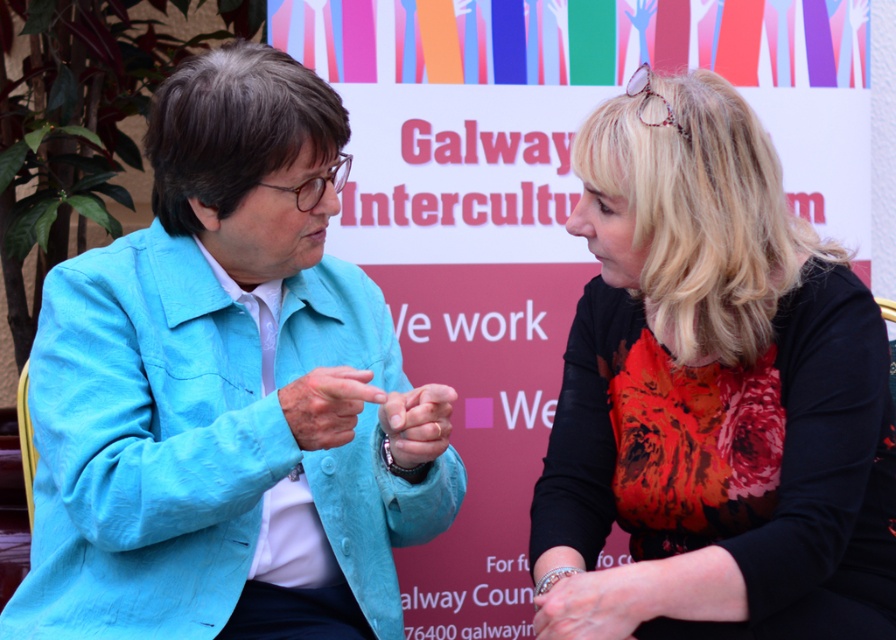
You are a photographer trying to capture a candid shot of the two people in the scene. You notice the floral print blouse at center and the matte blue finger at center. Which object should you focus on first if you want to capture the person on the right?

The floral print blouse at center is to the right of the matte blue finger at center, so focusing on the floral print blouse at center would be better to capture the person on the right.

You are a photographer trying to capture the interaction between the two people in the image. You notice the matte blue finger at center and the matte blue hand at center. Which one is located to the left of the other?

The matte blue finger at center is positioned on the left side of the matte blue hand at center.